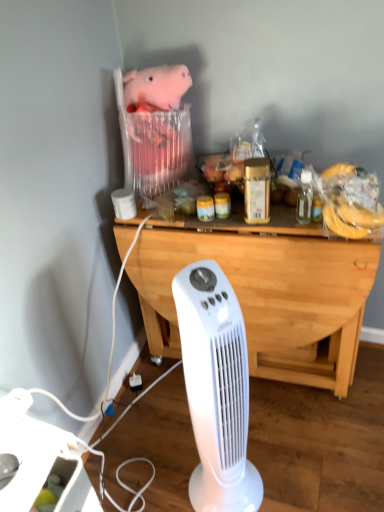
The width and height of the screenshot is (384, 512). In order to click on free space in front of light wood/dark brown desk at center in this screenshot , I will do `click(279, 449)`.